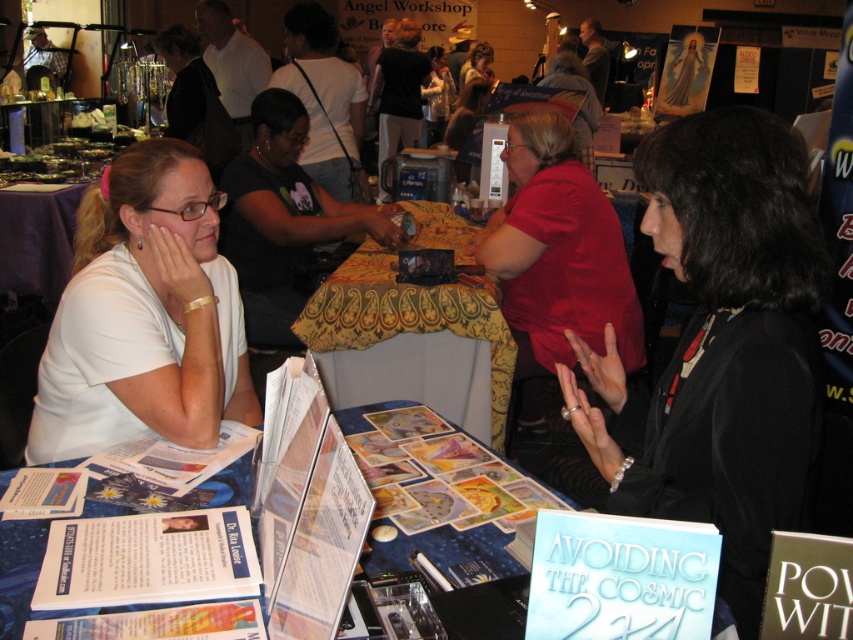
You are standing at the entrance of the convention center and see two points marked in the image. Which point is closer to you, point (556, 372) or point (276, 227)?

Point (556, 372) is in front of point (276, 227), so it is closer to you.

You are at a convention center and notice two women seated at a table with a blue cloth. One is wearing a white shirt and the other is dressed in black. Based on their positions, which woman is located closer to the point marked at coordinates [144,316]?

The woman wearing the white matte shirt at left is closer to the point marked at coordinates [144,316] because the point specifically marks the white matte shirt at left.